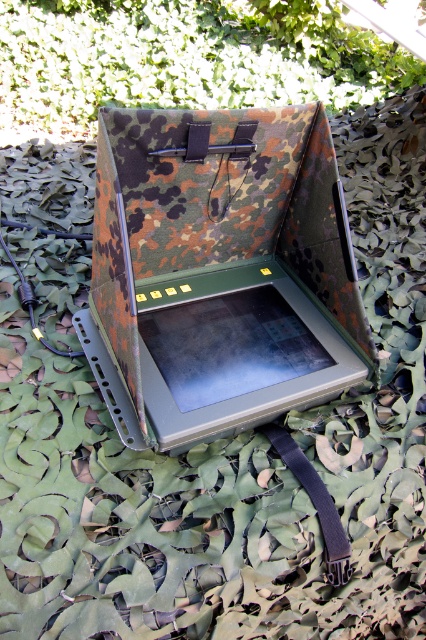
Can you confirm if camo fabric laptop at center is positioned to the right of matte black tablet at center?

In fact, camo fabric laptop at center is to the left of matte black tablet at center.

Can you confirm if camo fabric laptop at center is smaller than matte black tablet at center?

Incorrect, camo fabric laptop at center is not smaller in size than matte black tablet at center.

This screenshot has width=426, height=640. In order to click on camo fabric laptop at center in this screenshot , I will do `click(221, 269)`.

Does matte black tablet at center have a greater height compared to black fabric strap at center?

In fact, matte black tablet at center may be shorter than black fabric strap at center.

What do you see at coordinates (230, 346) in the screenshot? I see `matte black tablet at center` at bounding box center [230, 346].

Locate an element on the screen. The image size is (426, 640). matte black tablet at center is located at coordinates (230, 346).

Which is more to the right, camo fabric laptop at center or black fabric strap at center?

Positioned to the right is black fabric strap at center.

You are a GUI agent. You are given a task and a screenshot of the screen. Output one action in this format:
    pyautogui.click(x=<x>, y=<y>)
    Task: Click on the camo fabric laptop at center
    
    Given the screenshot: What is the action you would take?
    pyautogui.click(x=221, y=269)

Which is behind, point (317, 104) or point (328, 492)?

Point (317, 104)

Image resolution: width=426 pixels, height=640 pixels. In order to click on camo fabric laptop at center in this screenshot , I will do `click(221, 269)`.